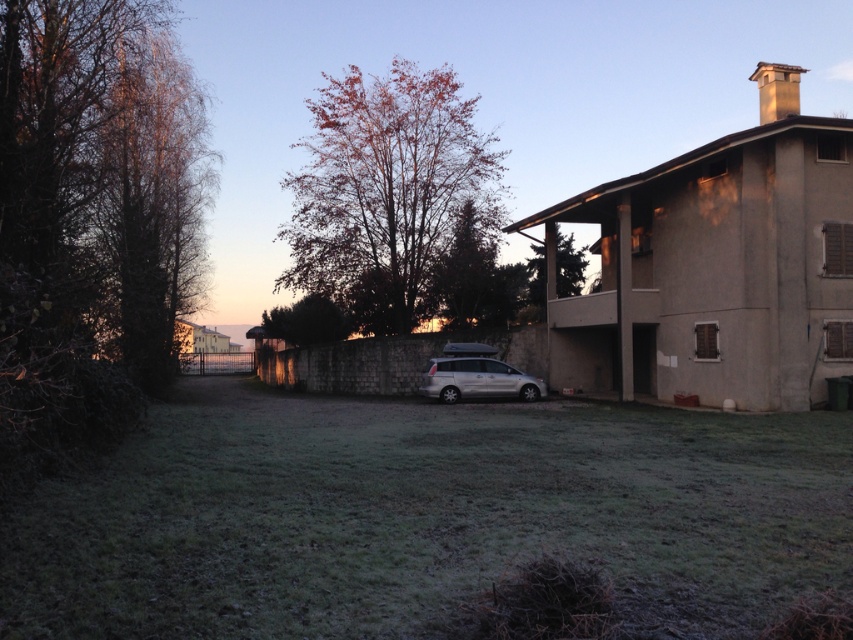
Question: Does green grass at center appear under dark brown bark tree at left?

Choices:
 (A) yes
 (B) no

Answer: (A)

Question: Estimate the real-world distances between objects in this image. Which object is closer to the dark brown bark tree at left?

Choices:
 (A) silver metallic van at center
 (B) green grass at center
 (C) orange-brown foliage at center
 (D) reddish-brown bark tree at center

Answer: (B)

Question: Based on their relative distances, which object is farther from the dark brown bark tree at left?

Choices:
 (A) green leafy tree at center
 (B) reddish-brown bark tree at center
 (C) silver metallic van at center

Answer: (B)

Question: Is the position of green grass at center more distant than that of green leafy tree at center?

Choices:
 (A) yes
 (B) no

Answer: (B)

Question: Does orange-brown foliage at center have a larger size compared to green leafy tree at upper center?

Choices:
 (A) yes
 (B) no

Answer: (A)

Question: Which point is closer to the camera?

Choices:
 (A) orange-brown foliage at center
 (B) green leafy tree at upper center
 (C) green leafy tree at center

Answer: (B)